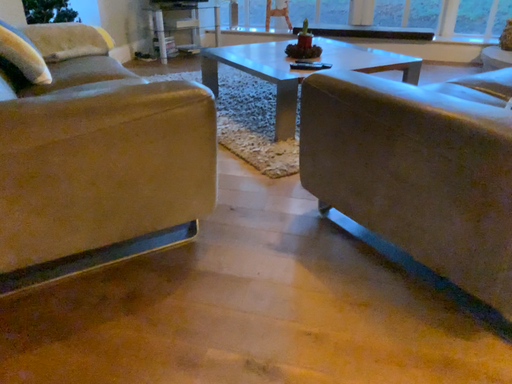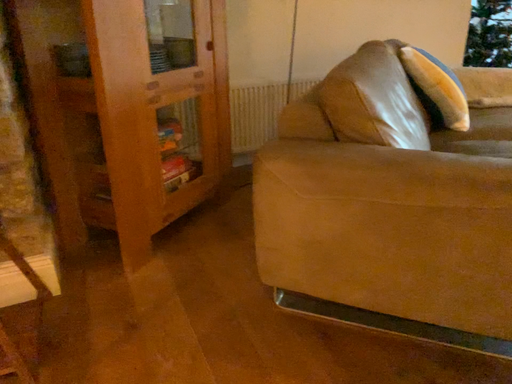
Question: Which way did the camera rotate in the video?

Choices:
 (A) rotated upward
 (B) rotated downward

Answer: (A)